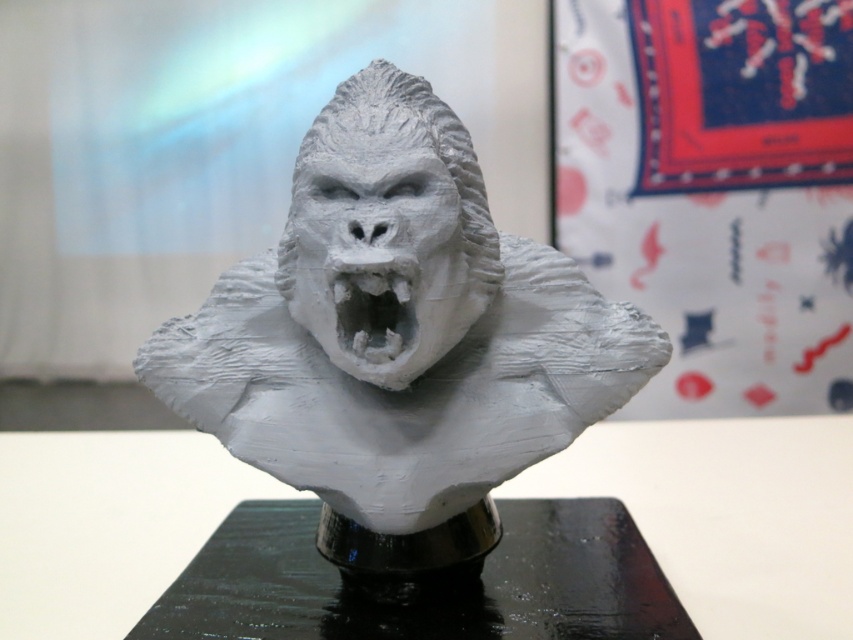
Question: Which of the following is the closest to the observer?

Choices:
 (A) white matte gorilla bust at center
 (B) white matte plastic mouth at center

Answer: (B)

Question: Does white matte gorilla bust at center appear over white matte plastic mouth at center?

Choices:
 (A) yes
 (B) no

Answer: (B)

Question: Which object is farther from the camera taking this photo?

Choices:
 (A) black glossy table at center
 (B) white matte gorilla bust at center

Answer: (A)

Question: In this image, where is white matte gorilla bust at center located relative to white matte plastic mouth at center?

Choices:
 (A) left
 (B) right

Answer: (B)

Question: Does white matte gorilla bust at center come behind black glossy table at center?

Choices:
 (A) yes
 (B) no

Answer: (B)

Question: Based on their relative distances, which object is farther from the white matte gorilla bust at center?

Choices:
 (A) white matte plastic mouth at center
 (B) black glossy table at center

Answer: (B)